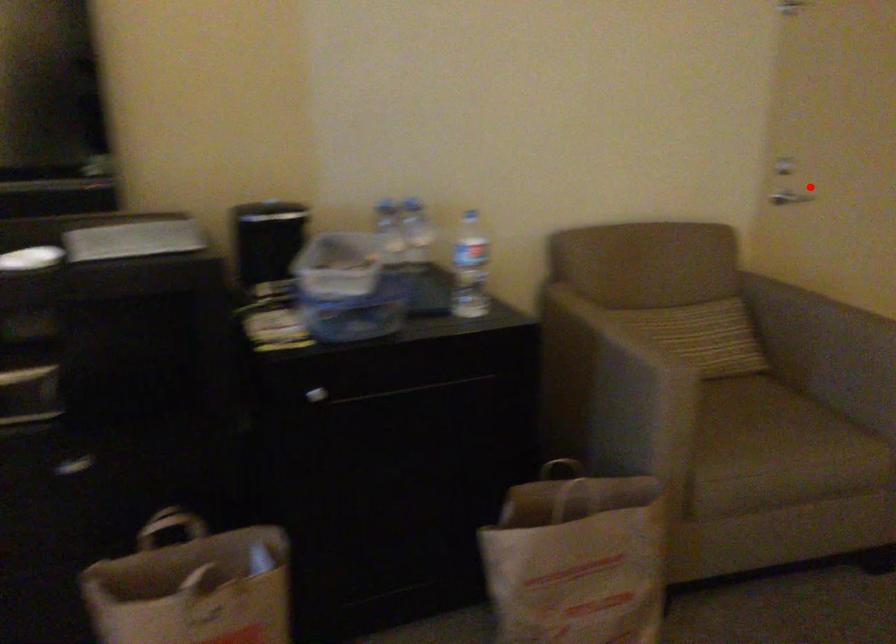
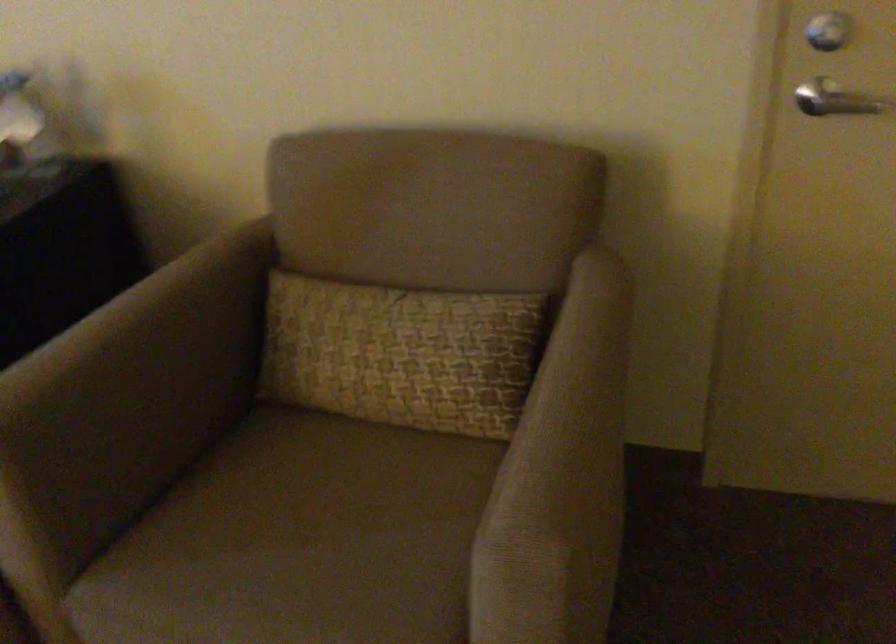
In the second image, find the point that corresponds to the highlighted location in the first image.

(840, 102)